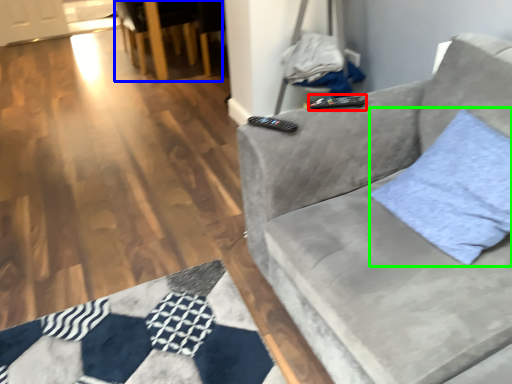
Question: Based on their relative distances, which object is nearer to remote (highlighted by a red box)? Choose from armchair (highlighted by a blue box) and throw pillow (highlighted by a green box).

Choices:
 (A) armchair
 (B) throw pillow

Answer: (B)